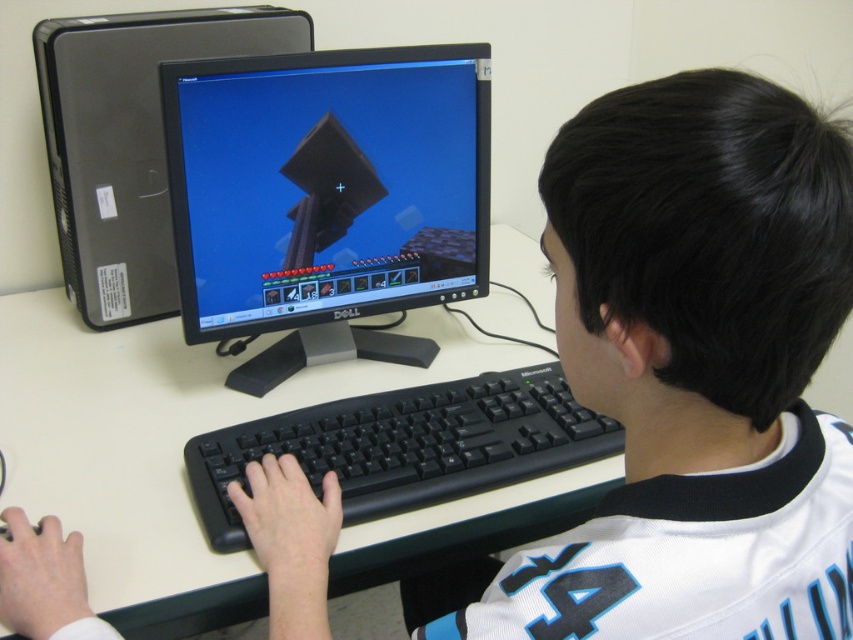
Does white jersey at center appear over matte black monitor at center?

Actually, white jersey at center is below matte black monitor at center.

Can you confirm if white jersey at center is positioned to the right of matte black monitor at center?

Yes, white jersey at center is to the right of matte black monitor at center.

What do you see at coordinates (695, 369) in the screenshot? Image resolution: width=853 pixels, height=640 pixels. I see `white jersey at center` at bounding box center [695, 369].

Identify the location of white jersey at center. The width and height of the screenshot is (853, 640). (695, 369).

Is point (595, 122) positioned in front of point (349, 570)?

Yes, point (595, 122) is closer to viewer.

In the scene shown: Is white jersey at center taller than white plastic computer desk at center?

In fact, white jersey at center may be shorter than white plastic computer desk at center.

Does point (297, 547) lie in front of point (102, 461)?

Yes, it is in front of point (102, 461).

I want to click on white jersey at center, so click(695, 369).

Can you confirm if white plastic computer desk at center is positioned to the right of black plastic keyboard at center?

In fact, white plastic computer desk at center is to the left of black plastic keyboard at center.

Find the location of `white plastic computer desk at center`. white plastic computer desk at center is located at coordinates point(163,444).